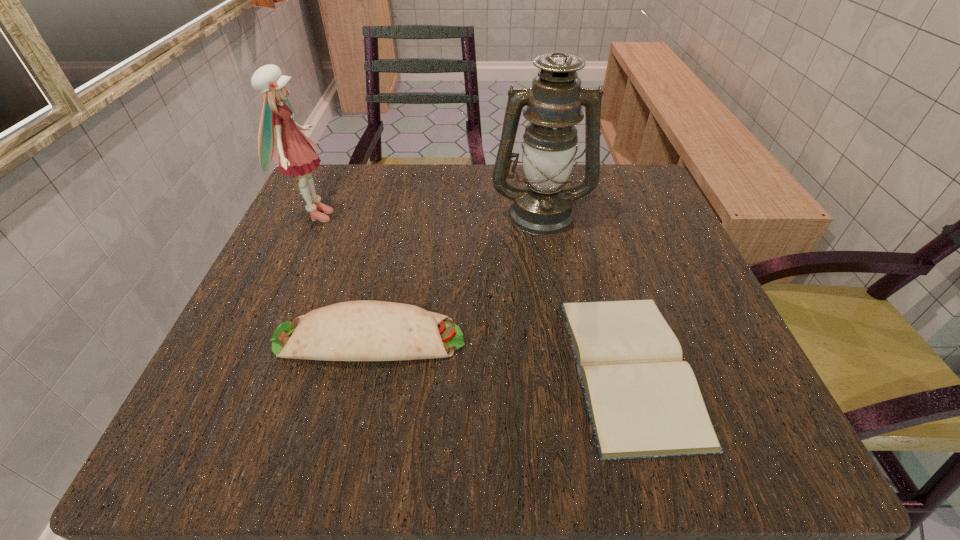
The image size is (960, 540). I want to click on object located in the near edge section of the desktop, so click(x=643, y=400).

In order to click on doll positioned at the left edge in this screenshot , I will do `click(294, 152)`.

Find the location of a particular element. This screenshot has width=960, height=540. burrito that is positioned at the left edge is located at coordinates (365, 330).

Where is `oil lamp present at the right edge`? oil lamp present at the right edge is located at coordinates (542, 206).

Where is `Bible situated at the right edge`? Bible situated at the right edge is located at coordinates 643,400.

This screenshot has width=960, height=540. In order to click on object that is at the far left corner in this screenshot , I will do `click(294, 152)`.

At what (x,y) coordinates should I click in order to perform the action: click on object present at the far right corner. Please return your answer as a coordinate pair (x, y). This screenshot has height=540, width=960. Looking at the image, I should click on (542, 206).

Where is `object present at the near right corner`? This screenshot has height=540, width=960. object present at the near right corner is located at coordinates (643, 400).

Where is `vacant region at the far edge of the desktop`? This screenshot has width=960, height=540. vacant region at the far edge of the desktop is located at coordinates (429, 179).

The width and height of the screenshot is (960, 540). In order to click on vacant space at the left edge of the desktop in this screenshot , I will do `click(244, 338)`.